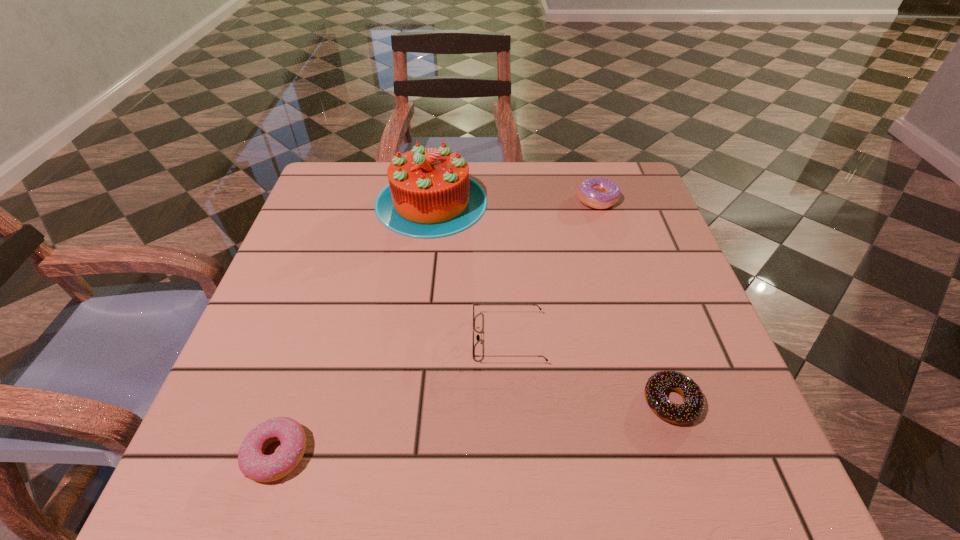
In the image, there is a desktop. Identify the location of free space at the left edge. The width and height of the screenshot is (960, 540). (276, 284).

You are a GUI agent. You are given a task and a screenshot of the screen. Output one action in this format:
    pyautogui.click(x=<x>, y=<y>)
    Task: Click on the vacant space at the right edge of the desktop
    
    Given the screenshot: What is the action you would take?
    pyautogui.click(x=675, y=294)

Where is `vacant space at the far right corner of the desktop`? Image resolution: width=960 pixels, height=540 pixels. vacant space at the far right corner of the desktop is located at coordinates (611, 172).

Identify the location of empty space that is in between the shortest object and the farthest doughnut. Image resolution: width=960 pixels, height=540 pixels. (635, 300).

Where is `free space between the farthest doughnut and the second tallest doughnut`? This screenshot has width=960, height=540. free space between the farthest doughnut and the second tallest doughnut is located at coordinates (437, 326).

Where is `vacant space in between the cake and the leftmost doughnut`? Image resolution: width=960 pixels, height=540 pixels. vacant space in between the cake and the leftmost doughnut is located at coordinates (354, 328).

You are a GUI agent. You are given a task and a screenshot of the screen. Output one action in this format:
    pyautogui.click(x=<x>, y=<y>)
    Task: Click on the free space that is in between the shortest object and the farthest doughnut
    The height and width of the screenshot is (540, 960).
    Given the screenshot: What is the action you would take?
    pyautogui.click(x=635, y=300)

Locate an element on the screen. free spot between the third farthest object and the shortest doughnut is located at coordinates (589, 370).

Find the location of a particular element. free space between the leftmost doughnut and the tallest object is located at coordinates (354, 328).

Locate an element on the screen. free area in between the cake and the second tallest doughnut is located at coordinates (354, 328).